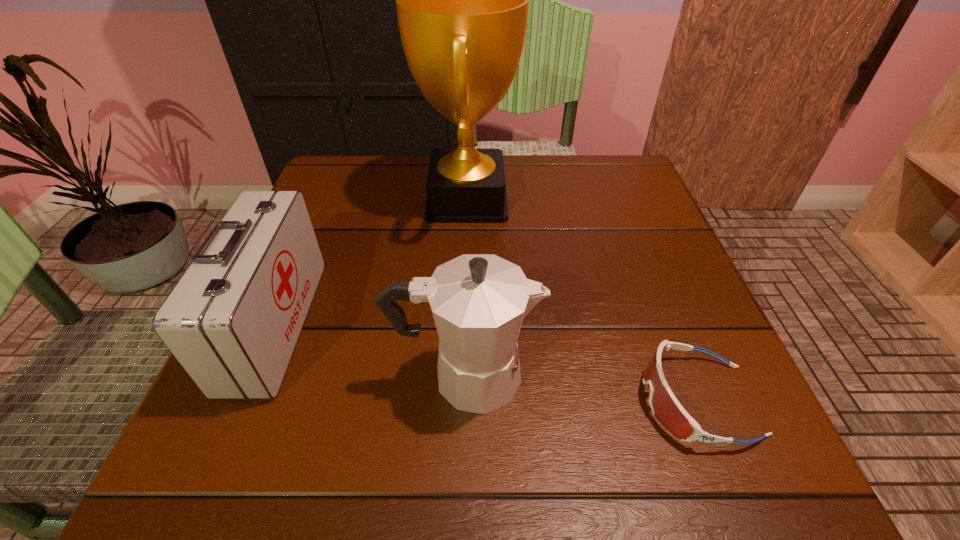
Image resolution: width=960 pixels, height=540 pixels. I want to click on free location located 0.120m on the front-facing side of the shortest object, so click(x=561, y=400).

Where is `vacant space located 0.260m on the front-facing side of the shortest object`? The height and width of the screenshot is (540, 960). vacant space located 0.260m on the front-facing side of the shortest object is located at coordinates (466, 400).

This screenshot has width=960, height=540. I want to click on blank area located 0.260m on the front-facing side of the shortest object, so click(x=466, y=400).

I want to click on object present at the far edge, so click(462, 0).

Where is `object that is at the near edge`? object that is at the near edge is located at coordinates (665, 406).

Find the location of a particular element. object at the left edge is located at coordinates [x=232, y=321].

Locate an element on the screen. This screenshot has width=960, height=540. object positioned at the right edge is located at coordinates (665, 406).

At what (x,y) coordinates should I click in order to perform the action: click on object that is at the near right corner. Please return your answer as a coordinate pair (x, y). Looking at the image, I should click on (665, 406).

Identify the location of vacant space at the far edge of the desktop. (412, 160).

In the image, there is a desktop. Identify the location of vacant space at the near edge. (449, 470).